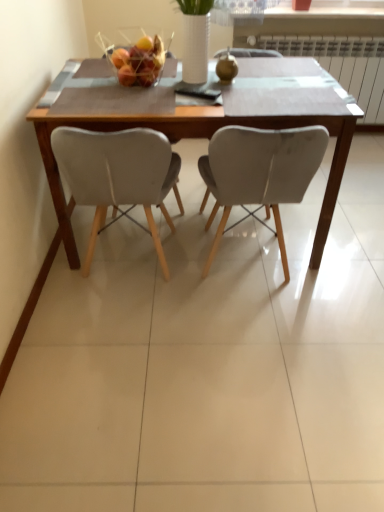
Question: From the image's perspective, is matte gray chair at center, which is the 1th chair from right to left, on wooden table at center?

Choices:
 (A) yes
 (B) no

Answer: (B)

Question: Is matte gray chair at center, marked as the 2th chair in a left-to-right arrangement, oriented away from wooden table at center?

Choices:
 (A) no
 (B) yes

Answer: (B)

Question: Considering the relative sizes of matte gray chair at center, which is the 1th chair from right to left, and wooden table at center in the image provided, is matte gray chair at center, which is the 1th chair from right to left, smaller than wooden table at center?

Choices:
 (A) yes
 (B) no

Answer: (A)

Question: Is matte gray chair at center, which is the 1th chair from right to left, placed right next to wooden table at center?

Choices:
 (A) yes
 (B) no

Answer: (B)

Question: Is matte gray chair at center, marked as the 2th chair in a left-to-right arrangement, facing towards wooden table at center?

Choices:
 (A) no
 (B) yes

Answer: (B)

Question: Can you confirm if matte gray chair at center, which is the 1th chair from right to left, is wider than wooden table at center?

Choices:
 (A) no
 (B) yes

Answer: (A)

Question: Does white plastic radiator at upper right have a greater height compared to matte gray chair at center, which is counted as the 2th chair, starting from the right?

Choices:
 (A) yes
 (B) no

Answer: (B)

Question: Does white plastic radiator at upper right touch matte gray chair at center, the first chair from the left?

Choices:
 (A) no
 (B) yes

Answer: (A)

Question: Does white plastic radiator at upper right have a lesser height compared to matte gray chair at center, the first chair from the left?

Choices:
 (A) yes
 (B) no

Answer: (A)

Question: Could you tell me if white plastic radiator at upper right is facing matte gray chair at center, which is counted as the 2th chair, starting from the right?

Choices:
 (A) yes
 (B) no

Answer: (A)

Question: Is matte gray chair at center, which is counted as the 2th chair, starting from the right, at the back of white plastic radiator at upper right?

Choices:
 (A) no
 (B) yes

Answer: (A)

Question: Considering the relative positions of white plastic radiator at upper right and matte gray chair at center, the first chair from the left, in the image provided, is white plastic radiator at upper right to the right of matte gray chair at center, the first chair from the left, from the viewer's perspective?

Choices:
 (A) no
 (B) yes

Answer: (B)

Question: Is matte gray chair at center, which is the 1th chair from right to left, a part of wooden table at center?

Choices:
 (A) yes
 (B) no

Answer: (A)